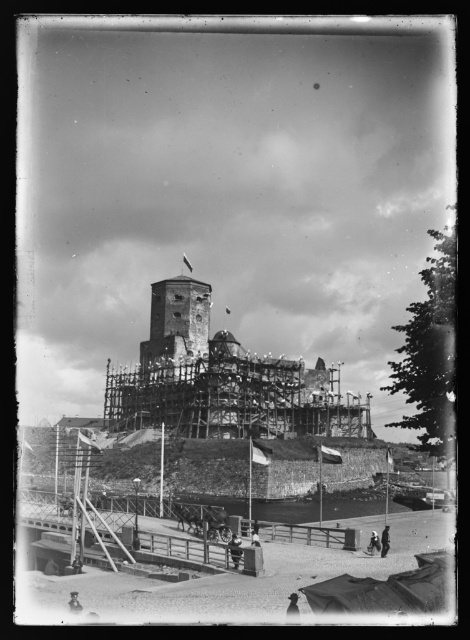
Can you confirm if wooden scaffolding at lower center is positioned to the right of rusty metal tower at center?

Yes, wooden scaffolding at lower center is to the right of rusty metal tower at center.

Based on the photo, can you confirm if wooden scaffolding at lower center is positioned below rusty metal tower at center?

Indeed, wooden scaffolding at lower center is positioned under rusty metal tower at center.

This screenshot has height=640, width=470. Describe the element at coordinates (206, 540) in the screenshot. I see `wooden scaffolding at lower center` at that location.

This screenshot has width=470, height=640. In order to click on wooden scaffolding at lower center in this screenshot , I will do `click(206, 540)`.